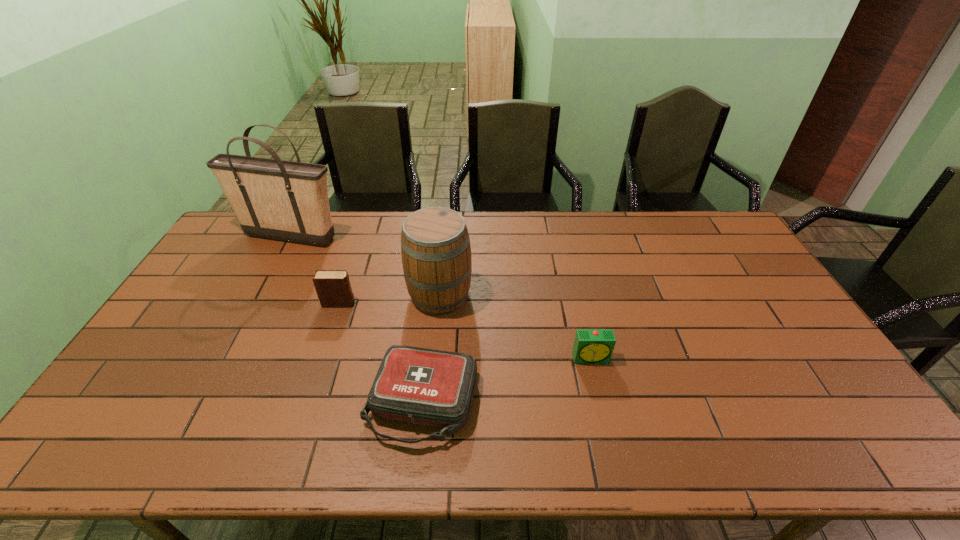
The width and height of the screenshot is (960, 540). In order to click on vacant area located 0.230m on the front-facing side of the rightmost object in this screenshot , I will do `click(612, 445)`.

Identify the location of vacant position located 0.280m on the left of the first-aid kit. (255, 402).

Find the location of a particular element. Image resolution: width=960 pixels, height=540 pixels. object located at the far edge is located at coordinates (275, 199).

Locate an element on the screen. object at the near edge is located at coordinates (416, 385).

At what (x,y) coordinates should I click in order to perform the action: click on object that is at the left edge. Please return your answer as a coordinate pair (x, y). This screenshot has width=960, height=540. Looking at the image, I should click on (275, 199).

The height and width of the screenshot is (540, 960). Identify the location of object that is at the far left corner. (275, 199).

Image resolution: width=960 pixels, height=540 pixels. In order to click on free space at the far edge of the desktop in this screenshot , I will do coord(397,234).

In the image, there is a desktop. At what (x,y) coordinates should I click in order to perform the action: click on vacant region at the left edge. Please return your answer as a coordinate pair (x, y). Looking at the image, I should click on (242, 252).

Identify the location of vacant space at the right edge of the desktop. (728, 267).

Locate an element on the screen. vacant space at the far right corner is located at coordinates (696, 246).